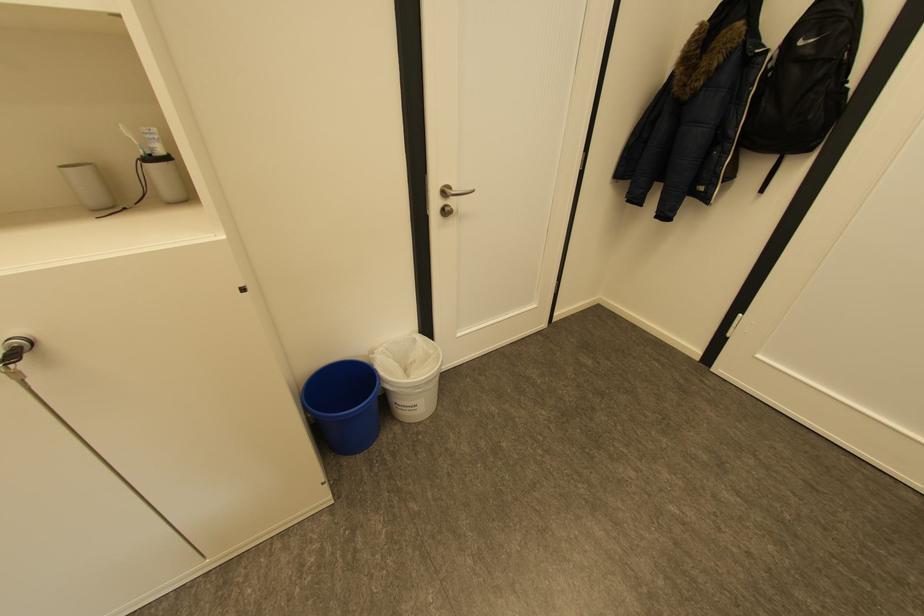
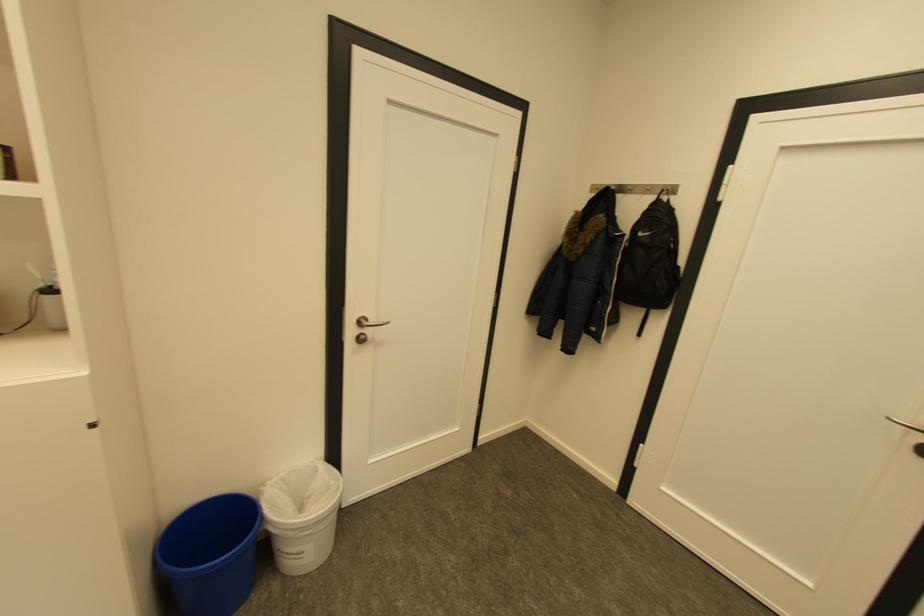
In the second image, find the point that corresponds to (394,349) in the first image.

(289, 477)